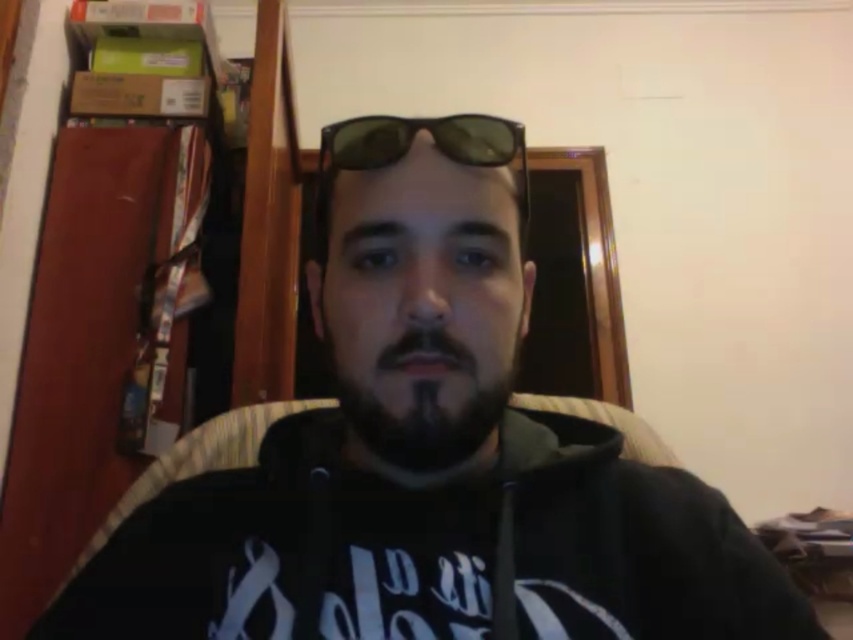
Which is above, dark brown beard at center or black matte sunglasses at center?

black matte sunglasses at center is higher up.

Which is behind, point (405, 465) or point (351, 128)?

Point (351, 128)

This screenshot has height=640, width=853. I want to click on dark brown beard at center, so click(x=422, y=396).